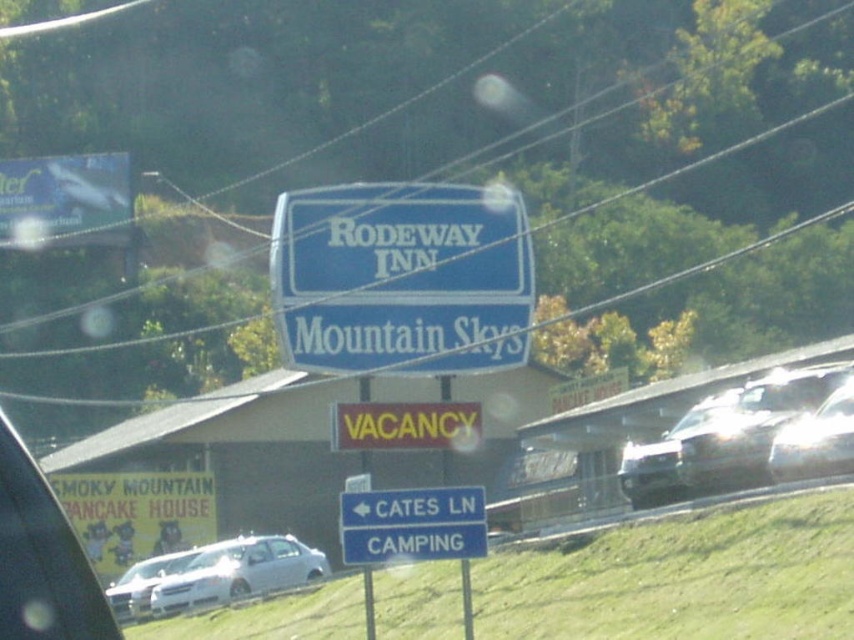
Does shiny silver sedan at center have a greater height compared to clear glass car window at lower center?

Yes, shiny silver sedan at center is taller than clear glass car window at lower center.

The image size is (854, 640). Find the location of `shiny silver sedan at center`. shiny silver sedan at center is located at coordinates coord(724,436).

Is silver metallic sedan at lower left positioned in front of blue plastic signpost at center?

No, silver metallic sedan at lower left is behind blue plastic signpost at center.

Is point (256, 579) positioned behind point (367, 637)?

Yes, it is.

Find the location of a particular element. The width and height of the screenshot is (854, 640). silver metallic sedan at lower left is located at coordinates (235, 573).

Which is below, satin silver sedan at right or clear glass car window at lower center?

clear glass car window at lower center is lower down.

Is point (835, 461) less distant than point (291, 540)?

Yes, it is in front of point (291, 540).

Does point (840, 417) come closer to viewer compared to point (299, 548)?

Yes, point (840, 417) is in front of point (299, 548).

Find the location of `satin silver sedan at right`. satin silver sedan at right is located at coordinates (816, 440).